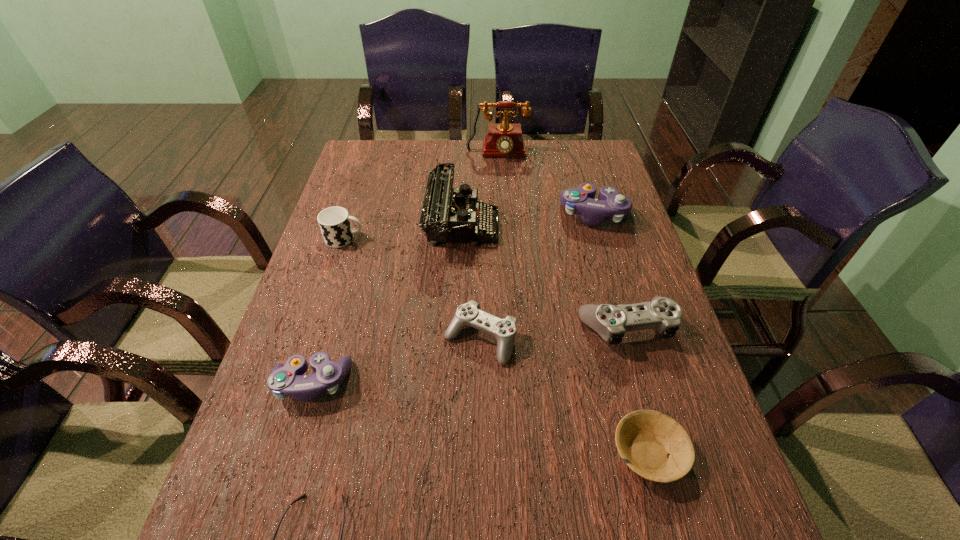
The image size is (960, 540). What are the coordinates of `object positioned at the far edge` in the screenshot? It's located at (503, 140).

At what (x,y) coordinates should I click in order to perform the action: click on cup located in the left edge section of the desktop. Please return your answer as a coordinate pair (x, y). Looking at the image, I should click on (334, 222).

Find the location of `control that is at the left edge`. control that is at the left edge is located at coordinates (285, 380).

At what (x,y) coordinates should I click in order to perform the action: click on bowl located in the right edge section of the desktop. Please return your answer as a coordinate pair (x, y). Looking at the image, I should click on (644, 438).

Locate an element on the screen. blank space at the left edge is located at coordinates (312, 338).

The height and width of the screenshot is (540, 960). Find the location of `free location at the far right corner of the desktop`. free location at the far right corner of the desktop is located at coordinates click(567, 172).

Where is `free space between the farthest control and the left white control`? free space between the farthest control and the left white control is located at coordinates (538, 277).

Where is `free point between the smaller purple control and the cup`? free point between the smaller purple control and the cup is located at coordinates (x=328, y=311).

Find the location of a particular element. This screenshot has width=960, height=540. free spot between the smaller purple control and the right white control is located at coordinates (468, 355).

The height and width of the screenshot is (540, 960). Find the location of `blank region between the black cup and the tallest object`. blank region between the black cup and the tallest object is located at coordinates (420, 197).